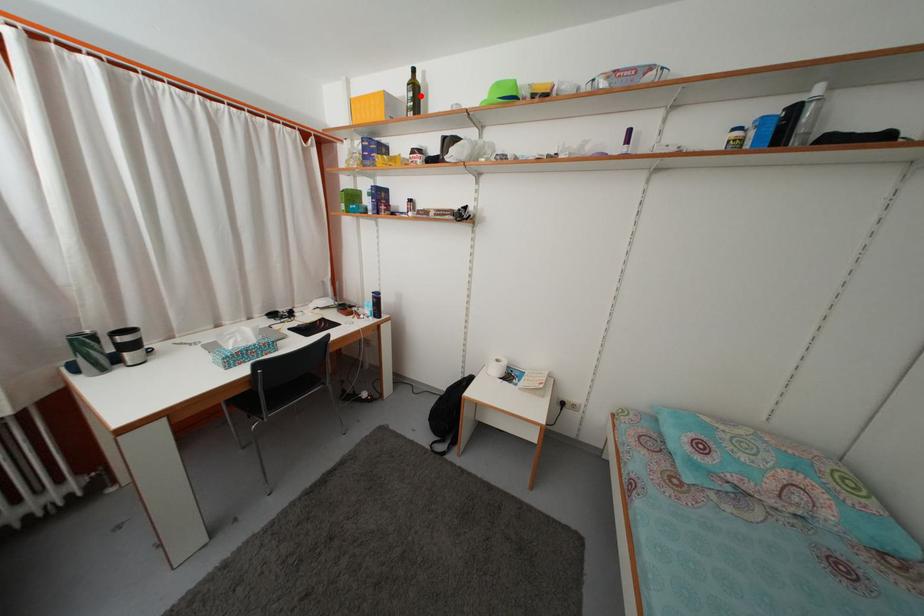
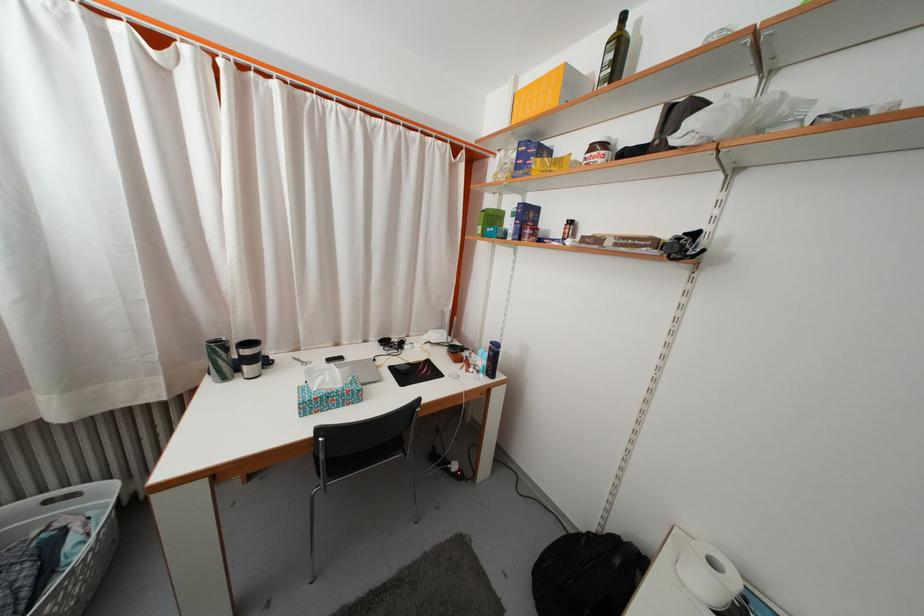
Find the pixel in the second image that matches the highlighted location in the first image.

(625, 54)